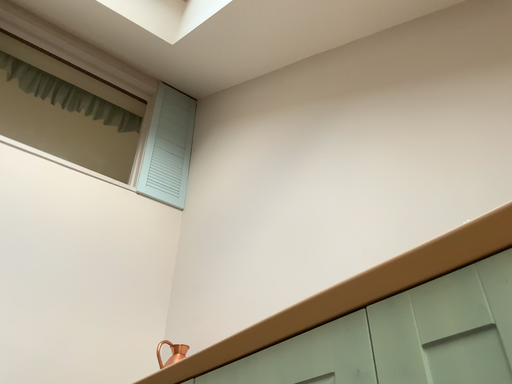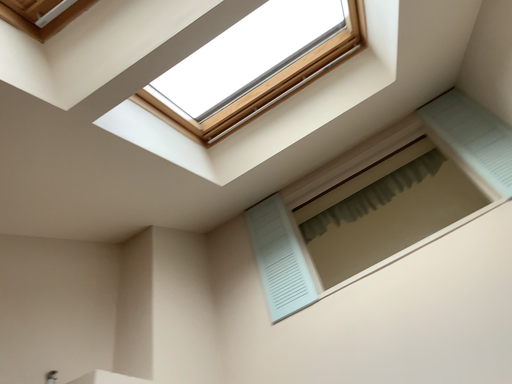
Question: Which way did the camera rotate in the video?

Choices:
 (A) rotated left
 (B) rotated right

Answer: (A)